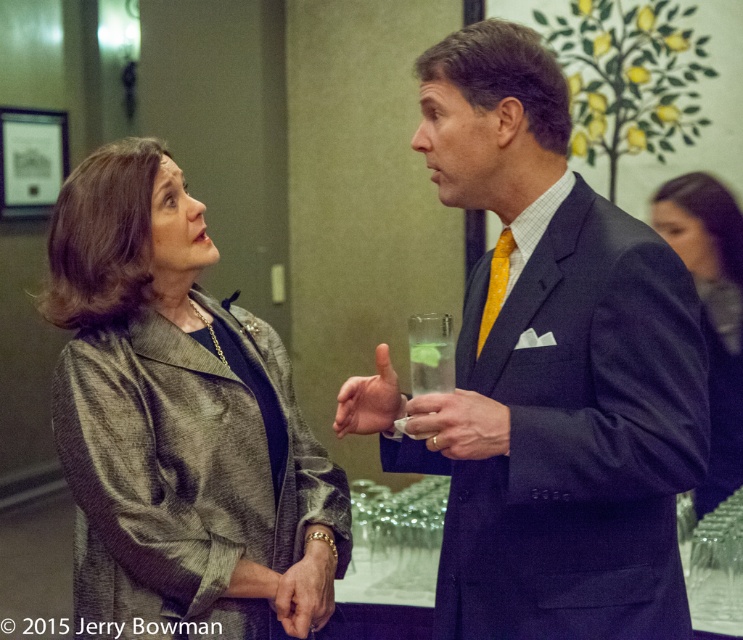
You are a photographer at a formal event. You need to position a matte black suit at center and a matte plastic cup at center such that the cup doesn not block the view of the suit. Given their widths, which object should be placed closer to the camera to ensure the suit remains visible?

The matte plastic cup at center should be placed closer to the camera because the matte black suit at center is wider. By positioning the narrower matte plastic cup at center in front, it won

You are a photographer at the event and need to capture a clear shot of both the dark blue fabric jacket at right and the matte plastic cup at center. However, the jacket is blocking the cup. Can you adjust your angle to see the cup without moving the objects?

The dark blue fabric jacket at right is positioned over the matte plastic cup at center, so adjusting your angle slightly downward might allow you to see the cup beneath the jacket.

You are a photographer at a formal event and need to capture a closeup of both the matte black suit at center and the matte plastic cup at center. Since your camera can only focus on one object at a time, which object should you focus on first to ensure the larger one is in focus?

The matte black suit at center is larger in size than the matte plastic cup at center, so you should focus on the matte black suit at center first to ensure the larger object is in focus.